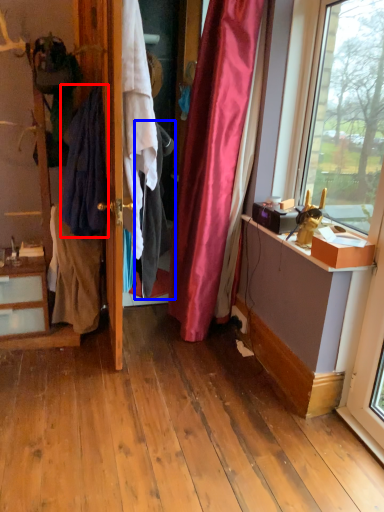
Question: Among these objects, which one is farthest to the camera, clothing (highlighted by a red box) or clothing (highlighted by a blue box)?

Choices:
 (A) clothing
 (B) clothing

Answer: (A)